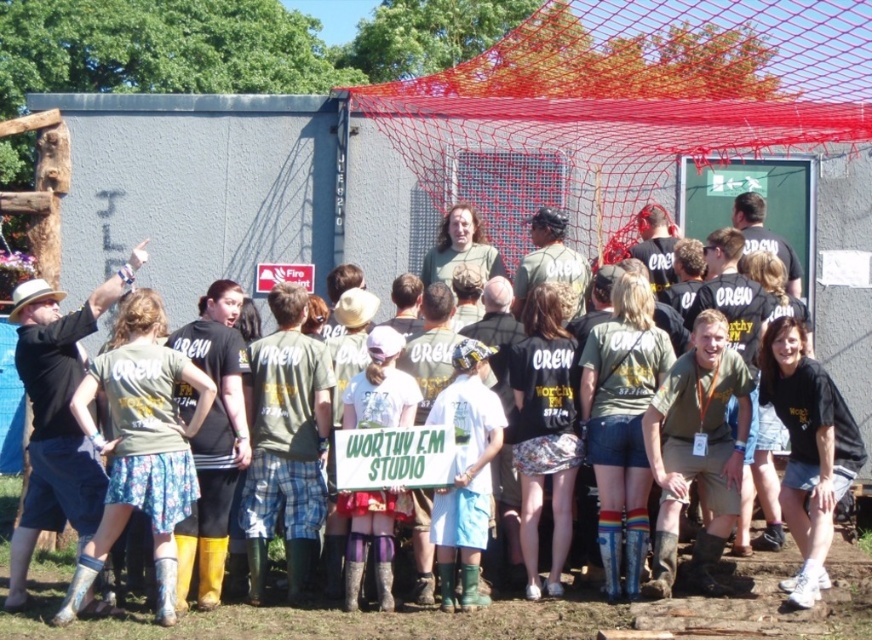
Is point (576, 240) behind point (383, 538)?

Yes, point (576, 240) is farther from viewer.

Which is behind, point (484, 99) or point (390, 529)?

The point (484, 99) is more distant.

You are a GUI agent. You are given a task and a screenshot of the screen. Output one action in this format:
    pyautogui.click(x=<x>, y=<y>)
    Task: Click on the red mesh net at upper center
    Image resolution: width=872 pixels, height=640 pixels.
    Given the screenshot: What is the action you would take?
    pyautogui.click(x=625, y=104)

Does matte khaki shorts at center have a greater width compared to black matte t-shirt at lower right?

Yes, matte khaki shorts at center is wider than black matte t-shirt at lower right.

Which is more to the right, matte khaki shorts at center or black matte t-shirt at lower right?

black matte t-shirt at lower right

Between point (714, 397) and point (794, 340), which one is positioned behind?

The point (714, 397) is more distant.

What are the coordinates of `matte khaki shorts at center` in the screenshot? It's located at (697, 449).

Does red mesh net at upper center appear on the left side of white plastic sign at center?

In fact, red mesh net at upper center is to the right of white plastic sign at center.

Is point (723, 144) less distant than point (276, 262)?

That is True.

In order to click on red mesh net at upper center in this screenshot , I will do `click(625, 104)`.